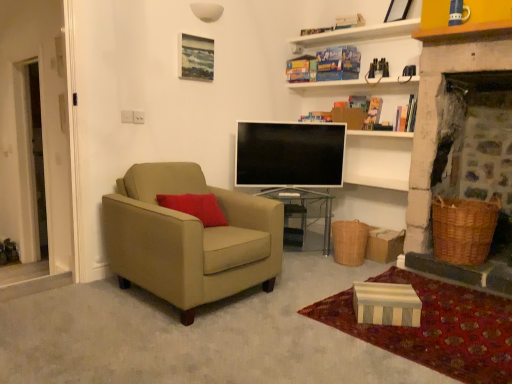
Question: Can you confirm if woven brown picnic basket at lower right, acting as the 2th picnic basket starting from the left, is wider than matte wooden picture frame at upper center?

Choices:
 (A) no
 (B) yes

Answer: (B)

Question: Does woven brown picnic basket at lower right, which is counted as the 1th picnic basket, starting from the right, have a larger size compared to matte wooden picture frame at upper center?

Choices:
 (A) no
 (B) yes

Answer: (B)

Question: Does woven brown picnic basket at lower right, which is counted as the 1th picnic basket, starting from the right, touch matte wooden picture frame at upper center?

Choices:
 (A) no
 (B) yes

Answer: (A)

Question: Does woven brown picnic basket at lower right, acting as the 2th picnic basket starting from the left, have a smaller size compared to matte wooden picture frame at upper center?

Choices:
 (A) no
 (B) yes

Answer: (A)

Question: Considering the relative sizes of woven brown picnic basket at lower right, acting as the 2th picnic basket starting from the left, and matte wooden picture frame at upper center in the image provided, is woven brown picnic basket at lower right, acting as the 2th picnic basket starting from the left, thinner than matte wooden picture frame at upper center?

Choices:
 (A) no
 (B) yes

Answer: (A)

Question: Is woven brown picnic basket at lower right, acting as the 2th picnic basket starting from the left, positioned in front of matte wooden picture frame at upper center?

Choices:
 (A) no
 (B) yes

Answer: (B)

Question: Is striped cardboard box at lower right positioned in front of striped cardboard box at lower right?

Choices:
 (A) no
 (B) yes

Answer: (A)

Question: Is striped cardboard box at lower right in contact with striped cardboard box at lower right?

Choices:
 (A) yes
 (B) no

Answer: (B)

Question: Could you tell me if striped cardboard box at lower right is facing striped cardboard box at lower right?

Choices:
 (A) no
 (B) yes

Answer: (A)

Question: Can you confirm if striped cardboard box at lower right is thinner than striped cardboard box at lower right?

Choices:
 (A) no
 (B) yes

Answer: (B)

Question: Can you confirm if striped cardboard box at lower right is wider than striped cardboard box at lower right?

Choices:
 (A) no
 (B) yes

Answer: (A)

Question: Can you confirm if striped cardboard box at lower right is shorter than striped cardboard box at lower right?

Choices:
 (A) no
 (B) yes

Answer: (A)

Question: Can you confirm if suede beige armchair at left is bigger than striped cardboard box at lower right?

Choices:
 (A) no
 (B) yes

Answer: (B)